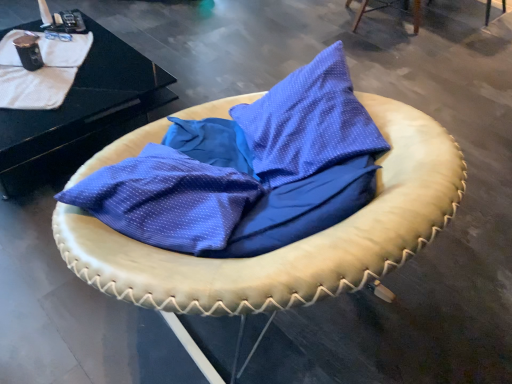
Measure the distance between point (38, 108) and camera.

They are 5.70 feet apart.

The width and height of the screenshot is (512, 384). Describe the element at coordinates (364, 12) in the screenshot. I see `leather cushion at upper right, positioned as the second furniture in bottom-to-top order` at that location.

The image size is (512, 384). Describe the element at coordinates (289, 245) in the screenshot. I see `leather cushion at center, positioned as the second furniture in back-to-front order` at that location.

The width and height of the screenshot is (512, 384). I want to click on black glossy table at upper left, so click(81, 115).

From the image's perspective, does black glossy table at upper left appear higher than white textured blanket at upper left?

Yes, from the image's perspective, black glossy table at upper left is over white textured blanket at upper left.

Would you say black glossy table at upper left is a long distance from white textured blanket at upper left?

That's not correct — black glossy table at upper left is a little close to white textured blanket at upper left.

Between black glossy table at upper left and white textured blanket at upper left, which one is positioned in front?

black glossy table at upper left is in front.

Is black glossy table at upper left facing towards white textured blanket at upper left?

No, black glossy table at upper left is not facing towards white textured blanket at upper left.

Considering the points (61, 101) and (87, 111), which point is in front, point (61, 101) or point (87, 111)?

The point (61, 101) is more forward.

Is white textured blanket at upper left completely or partially outside of black glossy table at upper left?

That's incorrect, white textured blanket at upper left is not completely outside black glossy table at upper left.

Identify the location of blanket that appears on the left of black glossy table at upper left. The width and height of the screenshot is (512, 384). (40, 71).

Is white textured blanket at upper left wider or thinner than black glossy table at upper left?

Clearly, white textured blanket at upper left has less width compared to black glossy table at upper left.

Considering the sizes of white textured blanket at upper left and leather cushion at upper right, the first furniture from the right, in the image, is white textured blanket at upper left wider or thinner than leather cushion at upper right, the first furniture from the right,?

Clearly, white textured blanket at upper left has less width compared to leather cushion at upper right, the first furniture from the right.

In the scene shown: From a real-world perspective, does white textured blanket at upper left sit lower than leather cushion at upper right, the 1th furniture viewed from the back?

Actually, white textured blanket at upper left is physically above leather cushion at upper right, the 1th furniture viewed from the back, in the real world.

In terms of height, does white textured blanket at upper left look taller or shorter compared to leather cushion at upper right, the first furniture from the right?

white textured blanket at upper left is shorter than leather cushion at upper right, the first furniture from the right.

Is white textured blanket at upper left not near leather cushion at upper right, the second furniture positioned from the left?

white textured blanket at upper left is far away from leather cushion at upper right, the second furniture positioned from the left.

Can you confirm if leather cushion at center, placed as the first furniture when sorted from bottom to top, is thinner than white textured blanket at upper left?

In fact, leather cushion at center, placed as the first furniture when sorted from bottom to top, might be wider than white textured blanket at upper left.

Measure the distance from leather cushion at center, the second furniture positioned from the top, to white textured blanket at upper left.

leather cushion at center, the second furniture positioned from the top, is 38.49 inches away from white textured blanket at upper left.

Is leather cushion at center, which is the 1th furniture in front-to-back order, positioned behind white textured blanket at upper left?

No, leather cushion at center, which is the 1th furniture in front-to-back order, is closer to the viewer.

Do you think leather cushion at center, the 1th furniture from the left, is within white textured blanket at upper left, or outside of it?

leather cushion at center, the 1th furniture from the left, lies outside white textured blanket at upper left.

Is black glossy table at upper left aimed at leather cushion at upper right, the second furniture positioned from the left?

No, black glossy table at upper left is not turned towards leather cushion at upper right, the second furniture positioned from the left.

Which object is positioned more to the right, black glossy table at upper left or leather cushion at upper right, the 1th furniture viewed from the back?

leather cushion at upper right, the 1th furniture viewed from the back.

Which is in front, point (162, 79) or point (345, 5)?

The point (162, 79) is closer.

From a real-world perspective, relative to leather cushion at center, positioned as the second furniture in back-to-front order, is white textured blanket at upper left vertically above or below?

white textured blanket at upper left is below leather cushion at center, positioned as the second furniture in back-to-front order.

From the picture: Between white textured blanket at upper left and leather cushion at center, placed as the first furniture when sorted from bottom to top, which one appears on the right side from the viewer's perspective?

leather cushion at center, placed as the first furniture when sorted from bottom to top, is more to the right.

Considering the sizes of white textured blanket at upper left and leather cushion at center, positioned as the second furniture in back-to-front order, in the image, is white textured blanket at upper left taller or shorter than leather cushion at center, positioned as the second furniture in back-to-front order,?

Considering their sizes, white textured blanket at upper left has less height than leather cushion at center, positioned as the second furniture in back-to-front order.

Considering the points (1, 64) and (115, 144), which point is in front, point (1, 64) or point (115, 144)?

Point (115, 144)

In order to click on table on the left of leather cushion at upper right, positioned as the second furniture in bottom-to-top order in this screenshot , I will do `click(81, 115)`.

From a real-world perspective, is leather cushion at upper right, the 2th furniture viewed from the front, located higher than black glossy table at upper left?

Actually, leather cushion at upper right, the 2th furniture viewed from the front, is physically below black glossy table at upper left in the real world.

Who is taller, leather cushion at upper right, the 2th furniture viewed from the front, or black glossy table at upper left?

black glossy table at upper left is taller.

Which object is wider, leather cushion at upper right, the first furniture from the right, or black glossy table at upper left?

black glossy table at upper left is wider.

The image size is (512, 384). In order to click on blanket above the black glossy table at upper left (from a real-world perspective) in this screenshot , I will do `click(40, 71)`.

This screenshot has width=512, height=384. Find the location of `table directly beneath the white textured blanket at upper left (from a real-world perspective)`. table directly beneath the white textured blanket at upper left (from a real-world perspective) is located at coordinates (81, 115).

When comparing their distances from leather cushion at upper right, positioned as the first furniture in top-to-bottom order, does leather cushion at center, the second furniture positioned from the top, or white textured blanket at upper left seem closer?

white textured blanket at upper left is closer to leather cushion at upper right, positioned as the first furniture in top-to-bottom order.

Considering their positions, is leather cushion at center, the second furniture positioned from the top, positioned closer to white textured blanket at upper left than black glossy table at upper left?

black glossy table at upper left is closer to white textured blanket at upper left.

Estimate the real-world distances between objects in this image. Which object is further from leather cushion at center, the 1th furniture from the left, white textured blanket at upper left or leather cushion at upper right, the second furniture positioned from the left?

Among the two, leather cushion at upper right, the second furniture positioned from the left, is located further to leather cushion at center, the 1th furniture from the left.

From the picture: Which object lies further to the anchor point black glossy table at upper left, white textured blanket at upper left or leather cushion at upper right, positioned as the first furniture in top-to-bottom order?

leather cushion at upper right, positioned as the first furniture in top-to-bottom order.

Which object lies further to the anchor point white textured blanket at upper left, black glossy table at upper left or leather cushion at center, the 1th furniture from the left?

leather cushion at center, the 1th furniture from the left, lies further to white textured blanket at upper left than the other object.

Estimate the real-world distances between objects in this image. Which object is closer to leather cushion at upper right, the 2th furniture viewed from the front, white textured blanket at upper left or black glossy table at upper left?

Based on the image, black glossy table at upper left appears to be nearer to leather cushion at upper right, the 2th furniture viewed from the front.

Based on their spatial positions, is leather cushion at center, placed as the first furniture when sorted from bottom to top, or white textured blanket at upper left further from black glossy table at upper left?

Based on the image, leather cushion at center, placed as the first furniture when sorted from bottom to top, appears to be further to black glossy table at upper left.

When comparing their distances from leather cushion at upper right, the first furniture from the right, does white textured blanket at upper left or leather cushion at center, placed as the first furniture when sorted from bottom to top, seem closer?

white textured blanket at upper left lies closer to leather cushion at upper right, the first furniture from the right, than the other object.

You are a GUI agent. You are given a task and a screenshot of the screen. Output one action in this format:
    pyautogui.click(x=<x>, y=<y>)
    Task: Click on the blanket between leather cushion at center, placed as the first furniture when sorted from bottom to top, and leather cushion at upper right, positioned as the first furniture in top-to-bottom order, from front to back
    The width and height of the screenshot is (512, 384).
    Given the screenshot: What is the action you would take?
    pyautogui.click(x=40, y=71)

Identify the location of table located between leather cushion at center, placed as the first furniture when sorted from bottom to top, and leather cushion at upper right, the first furniture from the right, in the depth direction. (81, 115).

You are a GUI agent. You are given a task and a screenshot of the screen. Output one action in this format:
    pyautogui.click(x=<x>, y=<y>)
    Task: Click on the table between leather cushion at center, positioned as the second furniture in back-to-front order, and white textured blanket at upper left, along the z-axis
    Image resolution: width=512 pixels, height=384 pixels.
    Given the screenshot: What is the action you would take?
    pyautogui.click(x=81, y=115)

The height and width of the screenshot is (384, 512). What are the coordinates of `table between white textured blanket at upper left and leather cushion at upper right, positioned as the second furniture in bottom-to-top order` in the screenshot? It's located at (81, 115).